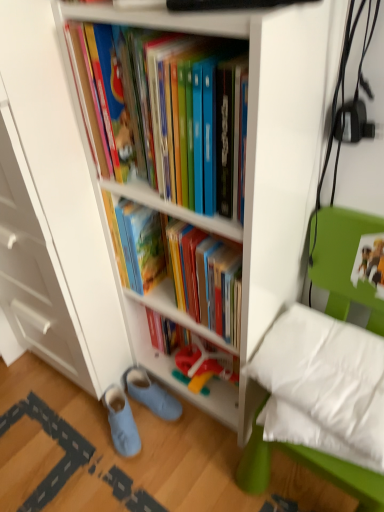
Question: From a real-world perspective, is light blue fabric slippers at lower left, placed as the 1th footwear when sorted from left to right, above or below white soft pillow at lower right?

Choices:
 (A) above
 (B) below

Answer: (B)

Question: Considering the relative positions of light blue fabric slippers at lower left, placed as the 1th footwear when sorted from left to right, and white soft pillow at lower right in the image provided, is light blue fabric slippers at lower left, placed as the 1th footwear when sorted from left to right, to the left or to the right of white soft pillow at lower right?

Choices:
 (A) left
 (B) right

Answer: (A)

Question: Estimate the real-world distances between objects in this image. Which object is closer to the light blue fabric slippers at lower left, placed as the 1th footwear when sorted from left to right?

Choices:
 (A) blue suede slippers at lower left, the 1th footwear positioned from the right
 (B) matte plastic shelf at center
 (C) white soft pillow at lower right
 (D) hardcover books at center, positioned as the first book in bottom-to-top order
 (E) matte plastic books at center, the 1th book positioned from the top

Answer: (A)

Question: Based on their relative distances, which object is farther from the white soft pillow at lower right?

Choices:
 (A) hardcover books at center, which is the second book from top to bottom
 (B) matte plastic shelf at center
 (C) matte plastic books at center, the 1th book positioned from the top
 (D) white glossy bookcase at center
 (E) blue suede slippers at lower left, the 1th footwear positioned from the right

Answer: (E)